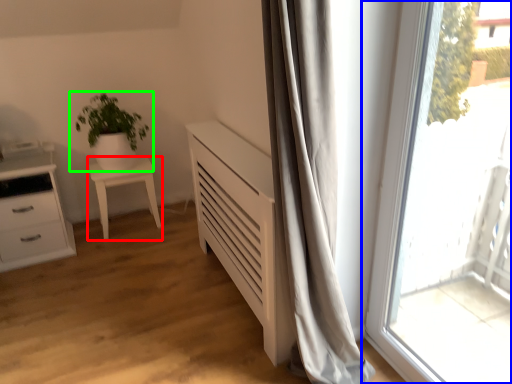
Question: Estimate the real-world distances between objects in this image. Which object is farther from furniture (highlighted by a red box), window (highlighted by a blue box) or houseplant (highlighted by a green box)?

Choices:
 (A) window
 (B) houseplant

Answer: (A)